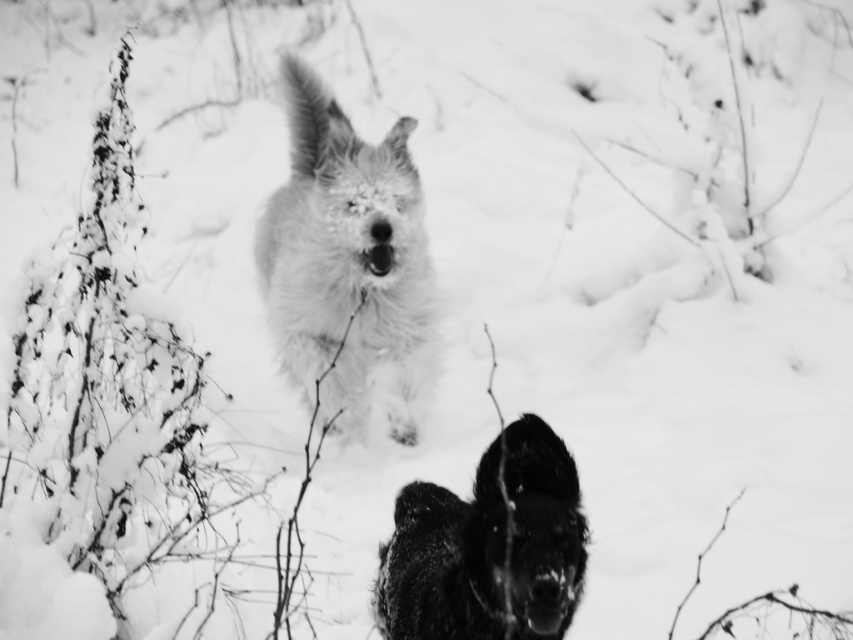
Question: Which point is farther from the camera taking this photo?

Choices:
 (A) (500, 627)
 (B) (322, 188)

Answer: (B)

Question: In this image, where is fluffy white dog at center located relative to fuzzy black dog at center?

Choices:
 (A) below
 (B) above

Answer: (B)

Question: Does fluffy white dog at center have a larger size compared to fuzzy black dog at center?

Choices:
 (A) yes
 (B) no

Answer: (A)

Question: Which point appears closest to the camera in this image?

Choices:
 (A) (387, 394)
 (B) (573, 483)

Answer: (B)

Question: Does fluffy white dog at center appear under fuzzy black dog at center?

Choices:
 (A) yes
 (B) no

Answer: (B)